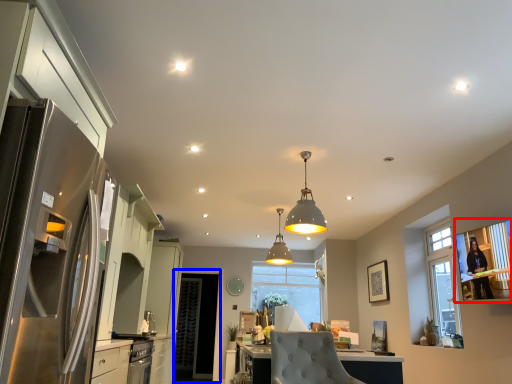
Question: Which point is closer to the camera, window screen (highlighted by a red box) or glass door (highlighted by a blue box)?

Choices:
 (A) window screen
 (B) glass door

Answer: (A)